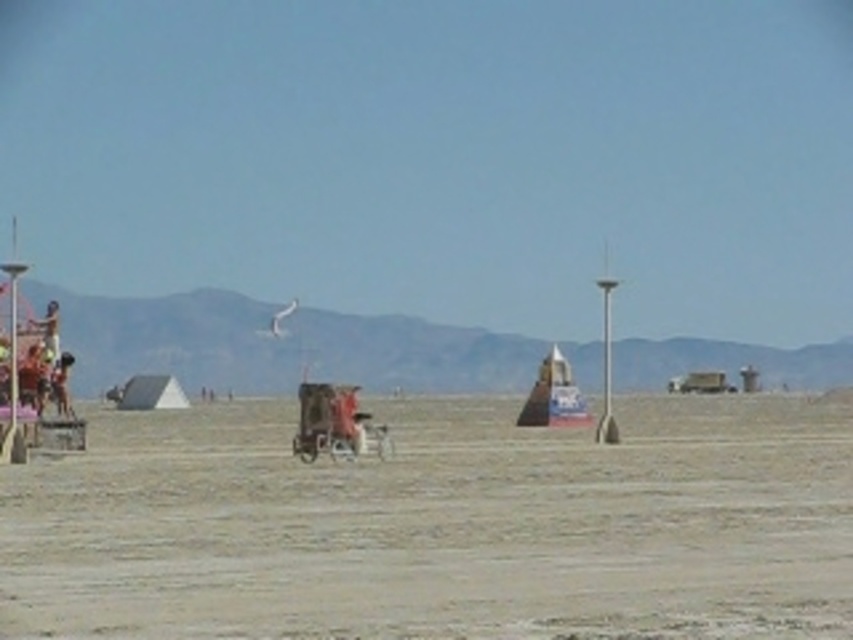
Does gray sand at center have a larger size compared to metallic silver baby carriage at center?

Indeed, gray sand at center has a larger size compared to metallic silver baby carriage at center.

Which is behind, point (103, 500) or point (380, 444)?

The point (380, 444) is more distant.

Where is `gray sand at center`? This screenshot has width=853, height=640. gray sand at center is located at coordinates (439, 524).